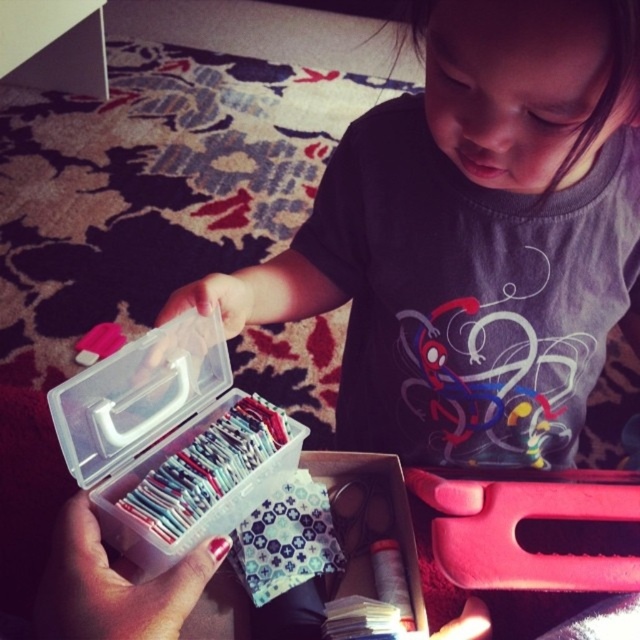
You are a robot trying to pick up the items in the scene. If you need to reach the point at (410, 380) first before the point at (218, 332), will you be able to do so without moving your arm?

Point (410, 380) is behind point (218, 332), so the robot cannot reach it first without moving its arm because it is obstructed by the closer point.

You are a toy organizer trying to place the matte plastic girl at center and the transparent plastic box at center on a shelf. If the shelf has limited space, which object should you place first to ensure both fit?

The transparent plastic box at center is smaller in size, so place it first to accommodate the larger matte plastic girl at center.